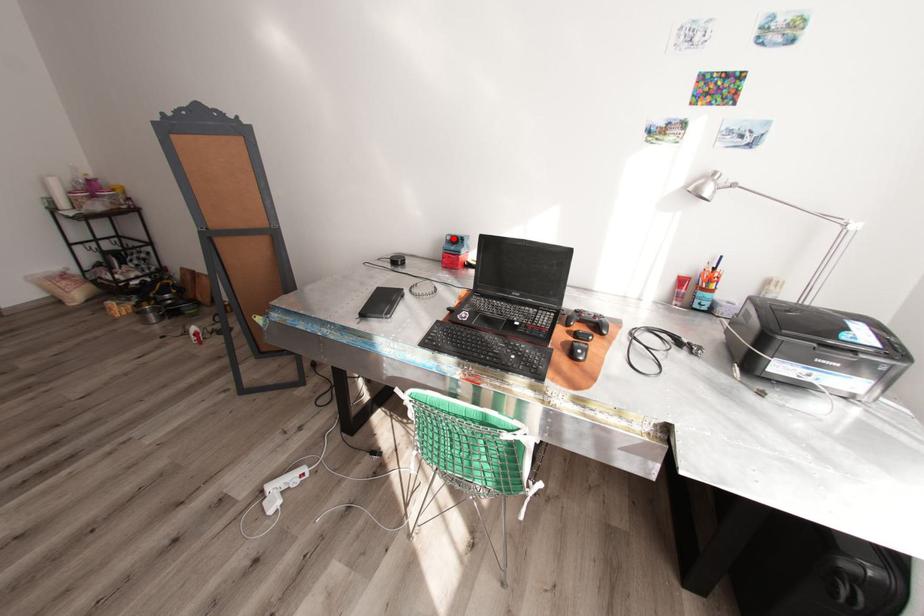
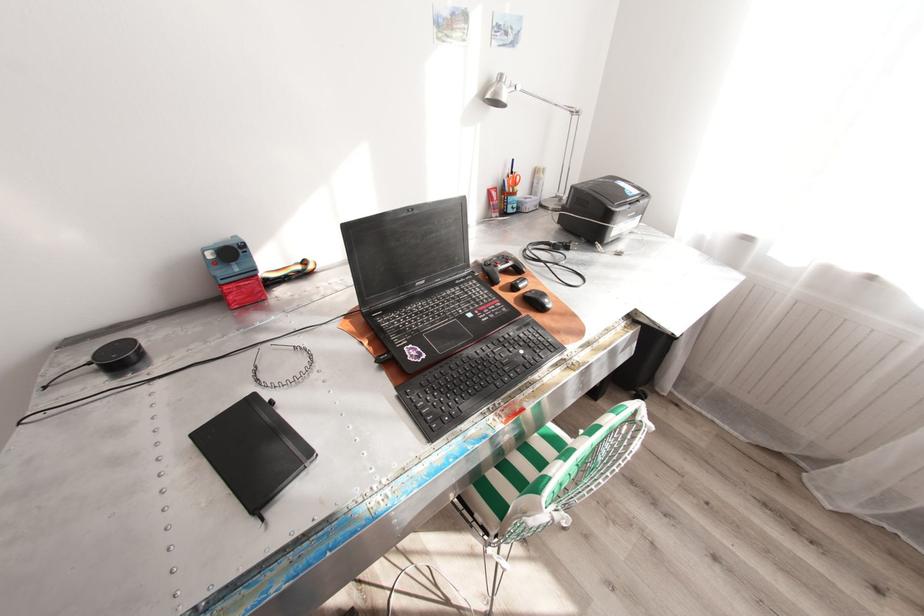
The point at the highlighted location is marked in the first image. Where is the corresponding point in the second image?

(215, 254)